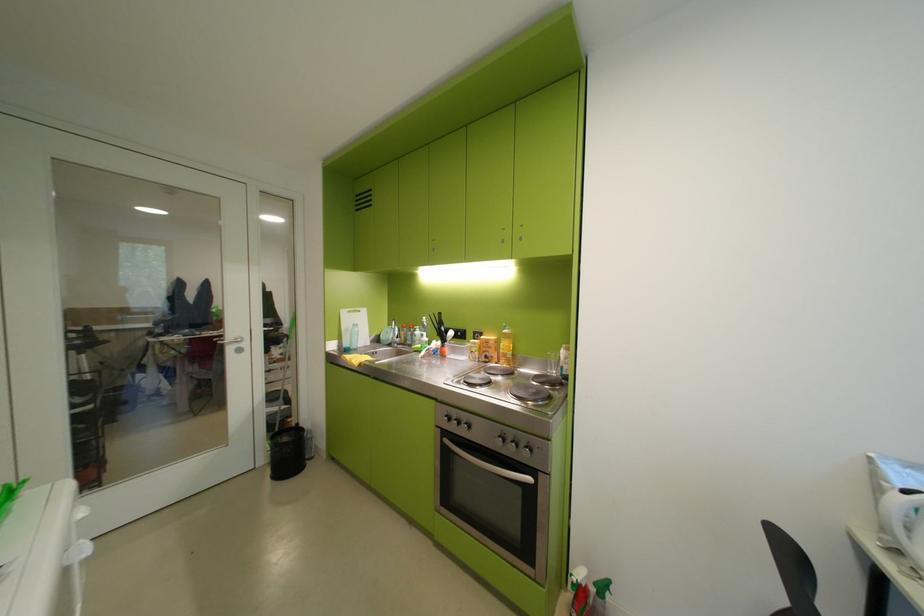
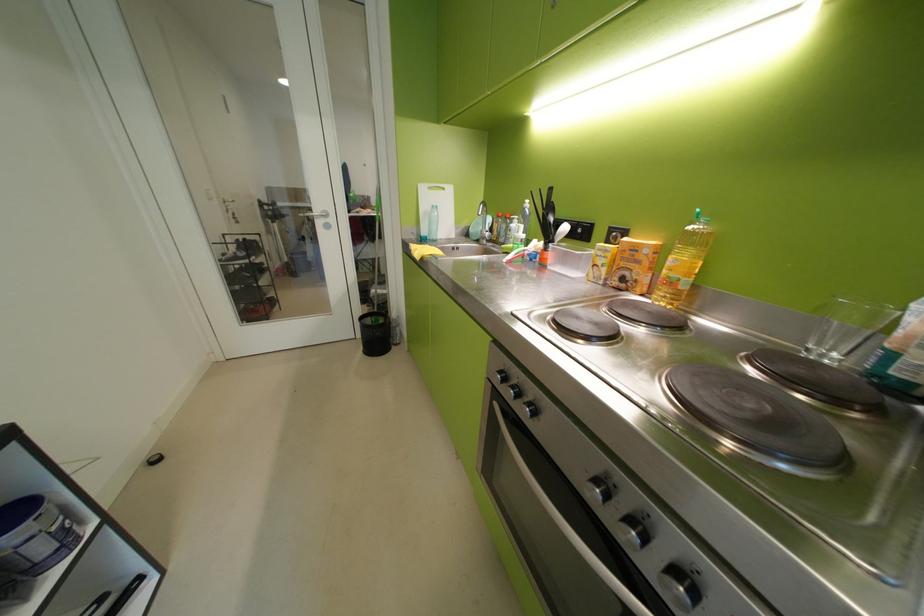
The point at (463, 427) is marked in the first image. Where is the corresponding point in the second image?

(517, 394)